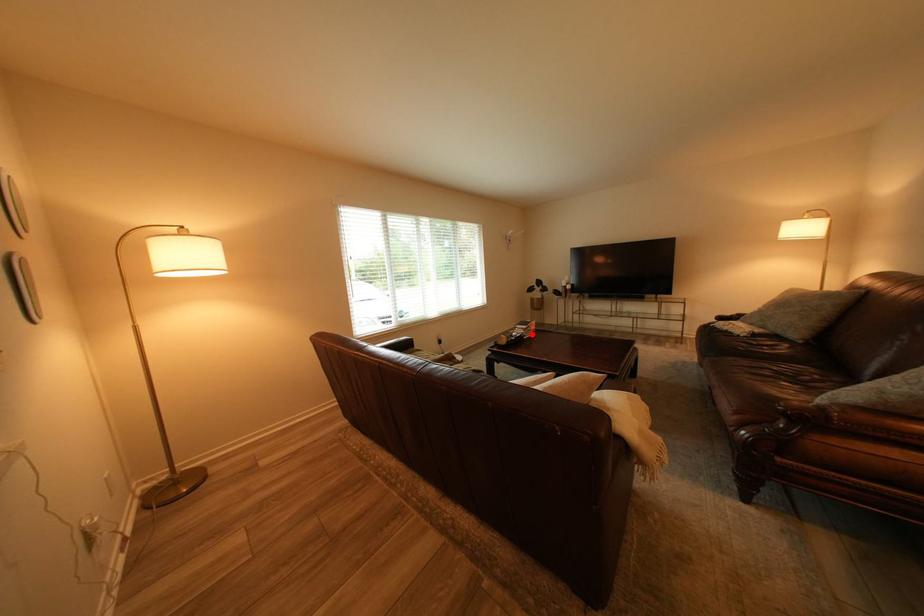
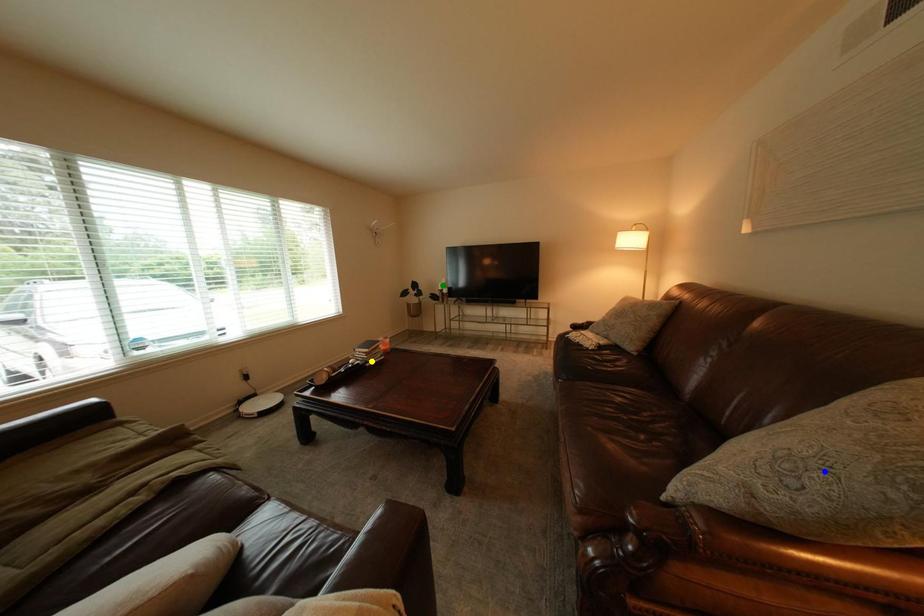
Question: I am providing you with two images of the same scene from different viewpoints. A red point is marked on the first image. You are given multiple points on the second image. Which mark in image 2 goes with the point in image 1?

Choices:
 (A) green point
 (B) yellow point
 (C) blue point

Answer: (B)